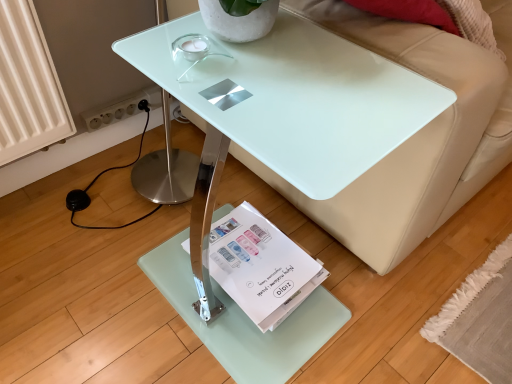
The image size is (512, 384). What do you see at coordinates (262, 267) in the screenshot?
I see `white paper magazine at lower center` at bounding box center [262, 267].

Locate an element on the screen. The image size is (512, 384). transparent glass table at center is located at coordinates (293, 104).

What do you see at coordinates (293, 104) in the screenshot?
I see `transparent glass table at center` at bounding box center [293, 104].

This screenshot has width=512, height=384. What do you see at coordinates (415, 135) in the screenshot? I see `beige leather couch at upper right` at bounding box center [415, 135].

The image size is (512, 384). I want to click on white paper magazine at lower center, so click(262, 267).

Is transparent glass table at center shorter than beige leather couch at upper right?

Indeed, transparent glass table at center has a lesser height compared to beige leather couch at upper right.

Can you confirm if transparent glass table at center is positioned to the left of beige leather couch at upper right?

Indeed, transparent glass table at center is positioned on the left side of beige leather couch at upper right.

From a real-world perspective, is transparent glass table at center beneath beige leather couch at upper right?

Yes.

Between beige leather couch at upper right and transparent glass table at center, which one has smaller size?

transparent glass table at center is smaller.

From the image's perspective, is beige leather couch at upper right positioned above or below transparent glass table at center?

beige leather couch at upper right is situated higher than transparent glass table at center in the image.

Considering the positions of points (393, 36) and (313, 27), is point (393, 36) closer to camera compared to point (313, 27)?

Yes, it is in front of point (313, 27).

How distant is beige leather couch at upper right from transparent glass table at center?

The distance of beige leather couch at upper right from transparent glass table at center is 8.64 inches.

Looking at the image, does transparent glass table at center seem bigger or smaller compared to white paper magazine at lower center?

Clearly, transparent glass table at center is larger in size than white paper magazine at lower center.

Would you consider transparent glass table at center to be distant from white paper magazine at lower center?

transparent glass table at center is actually quite close to white paper magazine at lower center.

Which object is further away from the camera taking this photo, transparent glass table at center or white paper magazine at lower center?

white paper magazine at lower center.

Does point (433, 106) appear closer or farther from the camera than point (309, 292)?

Point (433, 106) is closer to the camera than point (309, 292).

Does white paper magazine at lower center have a greater width compared to beige leather couch at upper right?

In fact, white paper magazine at lower center might be narrower than beige leather couch at upper right.

Considering the relative sizes of white paper magazine at lower center and beige leather couch at upper right in the image provided, is white paper magazine at lower center smaller than beige leather couch at upper right?

Yes, white paper magazine at lower center is smaller than beige leather couch at upper right.

Is beige leather couch at upper right inside white paper magazine at lower center?

No.

Based on the photo, from a real-world perspective, is white paper magazine at lower center located higher than transparent glass table at center?

Actually, white paper magazine at lower center is physically below transparent glass table at center in the real world.

At what (x,y) coordinates should I click in order to perform the action: click on magazine below the transparent glass table at center (from the image's perspective). Please return your answer as a coordinate pair (x, y). The height and width of the screenshot is (384, 512). Looking at the image, I should click on (262, 267).

Considering the positions of points (214, 260) and (234, 118), is point (214, 260) closer to camera compared to point (234, 118)?

No, it is not.

Between white paper magazine at lower center and transparent glass table at center, which one has smaller width?

white paper magazine at lower center.

Measure the distance between beige leather couch at upper right and white paper magazine at lower center.

beige leather couch at upper right is 11.93 inches away from white paper magazine at lower center.

How different are the orientations of beige leather couch at upper right and white paper magazine at lower center in degrees?

0.552 degrees.

Would you say beige leather couch at upper right is to the left or to the right of white paper magazine at lower center in the picture?

beige leather couch at upper right is to the right of white paper magazine at lower center.

From a real-world perspective, is beige leather couch at upper right physically above white paper magazine at lower center?

Indeed, from a real-world perspective, beige leather couch at upper right stands above white paper magazine at lower center.

In the image, there is a beige leather couch at upper right. Where is `table below it (from the image's perspective)`? Image resolution: width=512 pixels, height=384 pixels. table below it (from the image's perspective) is located at coordinates (293, 104).

Identify the location of table that is under the beige leather couch at upper right (from a real-world perspective). (293, 104).

Estimate the real-world distances between objects in this image. Which object is closer to beige leather couch at upper right, transparent glass table at center or white paper magazine at lower center?

Based on the image, transparent glass table at center appears to be nearer to beige leather couch at upper right.

From the image, which object appears to be farther from white paper magazine at lower center, beige leather couch at upper right or transparent glass table at center?

beige leather couch at upper right is positioned further to the anchor white paper magazine at lower center.

Considering their positions, is white paper magazine at lower center positioned closer to transparent glass table at center than beige leather couch at upper right?

The object closer to transparent glass table at center is beige leather couch at upper right.

Based on their spatial positions, is beige leather couch at upper right or white paper magazine at lower center further from transparent glass table at center?

The object further to transparent glass table at center is white paper magazine at lower center.

In the scene shown: Estimate the real-world distances between objects in this image. Which object is closer to white paper magazine at lower center, transparent glass table at center or beige leather couch at upper right?

The object closer to white paper magazine at lower center is transparent glass table at center.

When comparing their distances from beige leather couch at upper right, does white paper magazine at lower center or transparent glass table at center seem closer?

Among the two, transparent glass table at center is located nearer to beige leather couch at upper right.

Locate an element on the screen. This screenshot has width=512, height=384. table that lies between beige leather couch at upper right and white paper magazine at lower center from top to bottom is located at coordinates [293, 104].